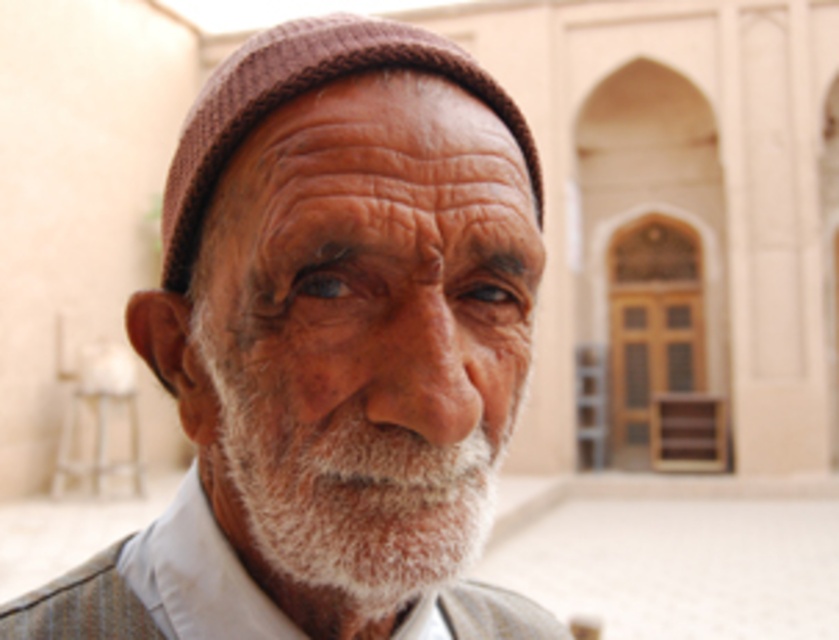
Which is more to the left, white soft beard at center or knitted brown hat at center?

Positioned to the left is knitted brown hat at center.

Who is shorter, white soft beard at center or knitted brown hat at center?

With less height is knitted brown hat at center.

Between point (340, 403) and point (447, 45), which one is positioned behind?

The point (447, 45) is behind.

This screenshot has height=640, width=839. What are the coordinates of `white soft beard at center` in the screenshot? It's located at (334, 470).

Does point (217, 602) come farther from viewer compared to point (394, 392)?

Yes.

Who is more forward, (269, 140) or (207, 372)?

Point (269, 140) is in front.

Locate an element on the screen. white woolen cap at center is located at coordinates (331, 349).

Is the position of white woolen cap at center more distant than that of knitted brown hat at center?

No, white woolen cap at center is closer to the viewer.

Can you confirm if white woolen cap at center is positioned above knitted brown hat at center?

No, white woolen cap at center is not above knitted brown hat at center.

Find the location of `white woolen cap at center`. white woolen cap at center is located at coordinates (331, 349).